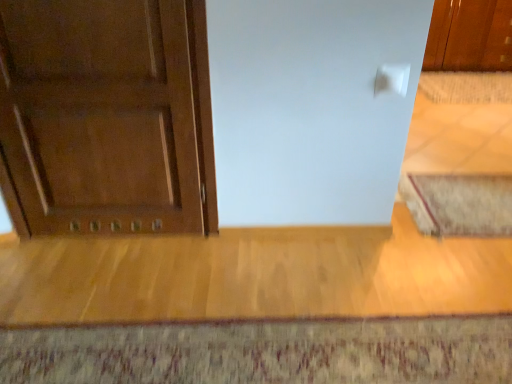
Question: Can you confirm if matte wood door at left is shorter than beige textured rug at lower right, which ranks as the second doormat in bottom-to-top order?

Choices:
 (A) yes
 (B) no

Answer: (B)

Question: Is matte wood door at left thinner than beige textured rug at lower right, which ranks as the second doormat in bottom-to-top order?

Choices:
 (A) no
 (B) yes

Answer: (B)

Question: Is matte wood door at left outside of beige textured rug at lower right, which ranks as the second doormat in bottom-to-top order?

Choices:
 (A) yes
 (B) no

Answer: (A)

Question: Considering the relative sizes of matte wood door at left and beige textured rug at lower right, the 2th doormat from the left, in the image provided, is matte wood door at left wider than beige textured rug at lower right, the 2th doormat from the left,?

Choices:
 (A) no
 (B) yes

Answer: (A)

Question: Does matte wood door at left have a smaller size compared to beige textured rug at lower right, placed as the 2th doormat when sorted from top to bottom?

Choices:
 (A) no
 (B) yes

Answer: (A)

Question: Does point (121, 160) appear closer or farther from the camera than point (398, 193)?

Choices:
 (A) closer
 (B) farther

Answer: (A)

Question: Would you say matte wood door at left is to the left or to the right of beige textured rug at lower right, the 2th doormat from the left, in the picture?

Choices:
 (A) right
 (B) left

Answer: (B)

Question: From the image's perspective, is matte wood door at left located above or below beige textured rug at lower right, acting as the 2th doormat starting from the right?

Choices:
 (A) above
 (B) below

Answer: (A)

Question: Relative to beige textured rug at lower right, which ranks as the second doormat in bottom-to-top order, is matte wood door at left in front or behind?

Choices:
 (A) front
 (B) behind

Answer: (A)

Question: Based on their sizes in the image, would you say textured wool doormat at lower center, which ranks as the third doormat in right-to-left order, is bigger or smaller than beige woven mat at right, the 1th doormat viewed from the back?

Choices:
 (A) big
 (B) small

Answer: (B)

Question: From their relative heights in the image, would you say textured wool doormat at lower center, positioned as the 1th doormat in front-to-back order, is taller or shorter than beige woven mat at right, which is the third doormat from left to right?

Choices:
 (A) tall
 (B) short

Answer: (B)

Question: Is textured wool doormat at lower center, which is counted as the 3th doormat, starting from the back, to the left or to the right of beige woven mat at right, which is the third doormat from left to right, in the image?

Choices:
 (A) right
 (B) left

Answer: (B)

Question: Is point (353, 347) positioned closer to the camera than point (422, 89)?

Choices:
 (A) closer
 (B) farther

Answer: (A)

Question: From a real-world perspective, is textured wool doormat at lower center, which is counted as the 3th doormat, starting from the back, above or below beige textured rug at lower right, acting as the 2th doormat starting from the back?

Choices:
 (A) above
 (B) below

Answer: (A)

Question: Considering their positions, is textured wool doormat at lower center, arranged as the 1th doormat when ordered from the bottom, located in front of or behind beige textured rug at lower right, placed as the 2th doormat when sorted from top to bottom?

Choices:
 (A) behind
 (B) front

Answer: (B)